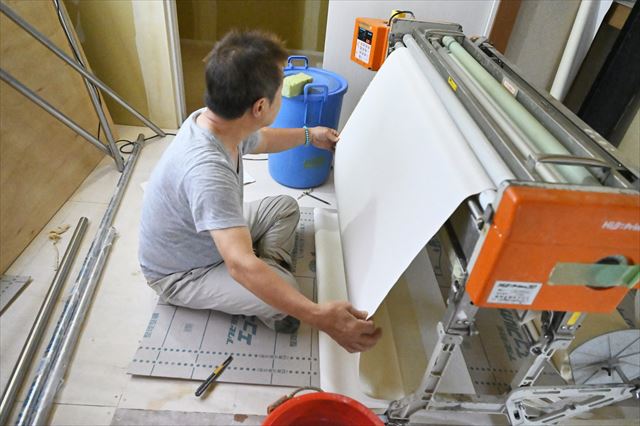
The width and height of the screenshot is (640, 426). Find the location of `white paper roll`. white paper roll is located at coordinates (410, 107).